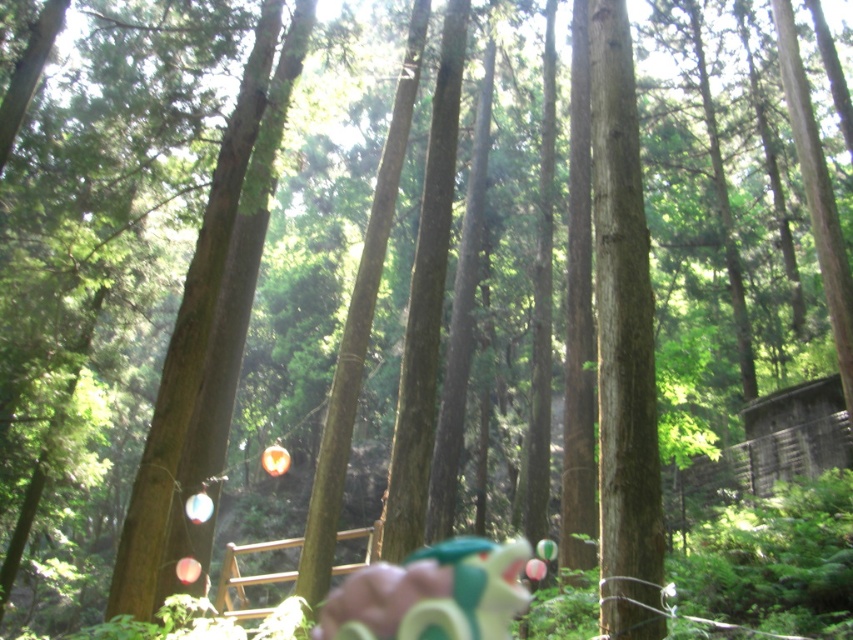
You are a hiker in the forest and want to take a photo of the green rubber dragon at center and the brown wooden fence at center. Which object will appear larger in the photo?

The brown wooden fence at center will appear larger in the photo because the green rubber dragon at center is not as tall as the brown wooden fence at center.

You are a hiker who has spotted the green rubber dragon at center and the brown wooden fence at center in the forest. Which object is closer to you?

The green rubber dragon at center is closer to you because it is positioned over the brown wooden fence at center, indicating it is in front of the fence.